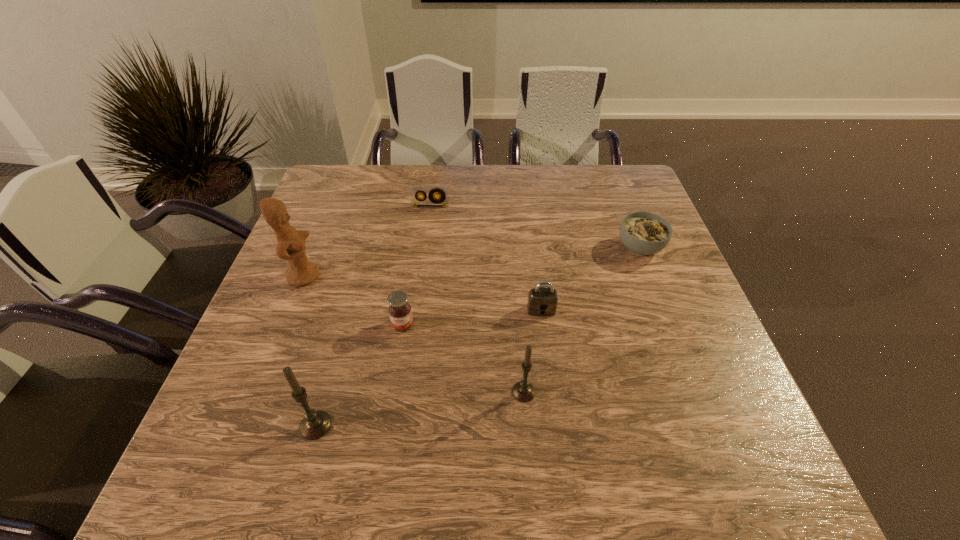
At what (x,y) coordinates should I click in order to perform the action: click on blank area at the far edge. Please return your answer as a coordinate pair (x, y). Image resolution: width=960 pixels, height=540 pixels. Looking at the image, I should click on (385, 204).

Find the location of a particular element. The image size is (960, 540). free location at the near edge is located at coordinates (479, 394).

This screenshot has width=960, height=540. What are the coordinates of `free spot at the left edge of the desktop` in the screenshot? It's located at (320, 222).

Find the location of a particular element. This screenshot has width=960, height=540. free region at the right edge of the desktop is located at coordinates (685, 287).

In the image, there is a desktop. Where is `free space at the far left corner`? The image size is (960, 540). free space at the far left corner is located at coordinates (326, 193).

The width and height of the screenshot is (960, 540). Find the location of `vacant space at the far right corner`. vacant space at the far right corner is located at coordinates (627, 196).

At what (x,y) coordinates should I click in order to perform the action: click on blank region between the left candle and the farthest object. Please return your answer as a coordinate pair (x, y). This screenshot has width=960, height=540. Looking at the image, I should click on (372, 316).

Identify the location of vacant area that lies between the soup bowl and the figurine. This screenshot has width=960, height=540. (472, 261).

You are a GUI agent. You are given a task and a screenshot of the screen. Output one action in this format:
    pyautogui.click(x=<x>, y=<y>)
    Task: Click on the free spot between the padlock and the jam
    
    Given the screenshot: What is the action you would take?
    pyautogui.click(x=472, y=318)

Where is `blank region between the second object from right to left and the tallest object`? This screenshot has width=960, height=540. blank region between the second object from right to left and the tallest object is located at coordinates (422, 293).